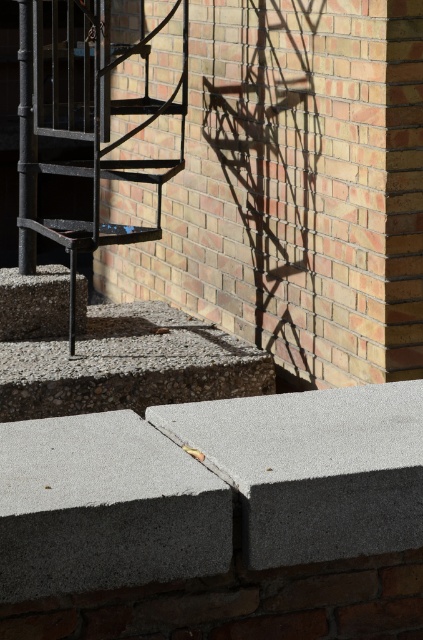
Question: Can you confirm if gray concrete at lower right is positioned to the right of gray rough concrete at center?

Choices:
 (A) yes
 (B) no

Answer: (A)

Question: Which object appears closest to the camera in this image?

Choices:
 (A) gray concrete at center
 (B) black metal fire escape at left
 (C) gray rough concrete at center

Answer: (A)

Question: Which is farther from the black metal fire escape at left?

Choices:
 (A) gray concrete at lower right
 (B) gray rough concrete at center
 (C) gray concrete at center

Answer: (A)

Question: Considering the relative positions of gray concrete at center and black metal fire escape at left in the image provided, where is gray concrete at center located with respect to black metal fire escape at left?

Choices:
 (A) below
 (B) above

Answer: (A)

Question: Is gray concrete at center positioned before gray rough concrete at center?

Choices:
 (A) yes
 (B) no

Answer: (A)

Question: Which object appears farthest from the camera in this image?

Choices:
 (A) gray rough concrete at center
 (B) black metal fire escape at left
 (C) gray concrete at lower right
 (D) gray concrete at center

Answer: (B)